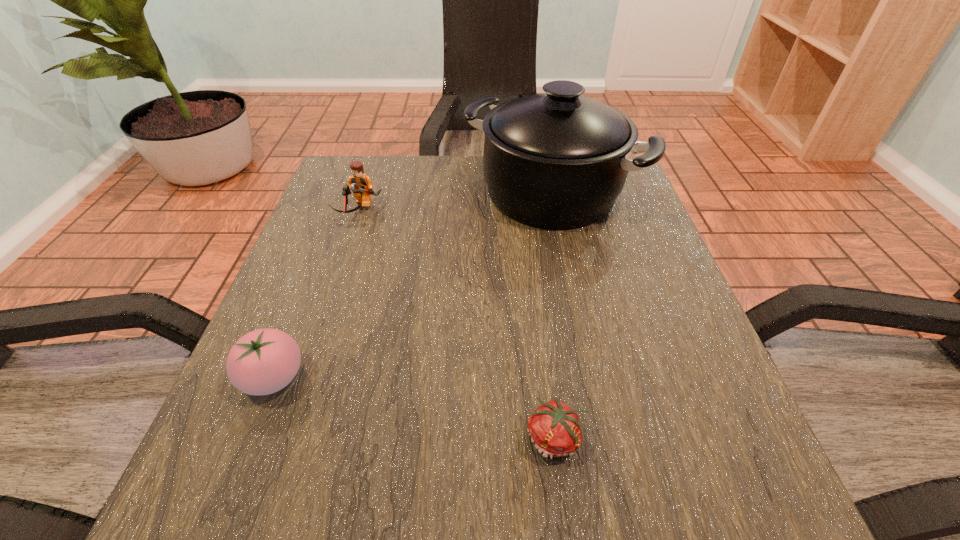
Locate an element on the screen. This screenshot has width=960, height=540. vacant space in between the Lego and the shorter tomato is located at coordinates (457, 325).

Where is `vacant area that lies between the third shortest object and the taller tomato`? The height and width of the screenshot is (540, 960). vacant area that lies between the third shortest object and the taller tomato is located at coordinates (316, 294).

This screenshot has height=540, width=960. In order to click on free space between the shorter tomato and the third tallest object in this screenshot , I will do `click(415, 408)`.

Find the location of a particular element. The height and width of the screenshot is (540, 960). unoccupied position between the shorter tomato and the third tallest object is located at coordinates (415, 408).

This screenshot has width=960, height=540. Find the location of `unoccupied area between the third farthest object and the shortest object`. unoccupied area between the third farthest object and the shortest object is located at coordinates (415, 408).

Identify the location of object that is the nearest to the second nearest object. click(x=555, y=428).

Identify which object is located as the third nearest to the second tallest object. Please provide its 2D coordinates. Your answer should be formatted as a tuple, i.e. [(x, y)], where the tuple contains the x and y coordinates of a point satisfying the conditions above.

[(555, 428)]

Locate an element on the screen. Image resolution: width=960 pixels, height=540 pixels. vacant space that satisfies the following two spatial constraints: 1. on the front side of the nearest object; 2. on the left side of the second shortest object is located at coordinates (250, 438).

At what (x,y) coordinates should I click in order to perform the action: click on free space that satisfies the following two spatial constraints: 1. holding a crossbow in the hands of the Lego; 2. on the left side of the right tomato. Please return your answer as a coordinate pair (x, y). This screenshot has width=960, height=540. Looking at the image, I should click on (281, 438).

Locate an element on the screen. The image size is (960, 540). vacant space that satisfies the following two spatial constraints: 1. on the back side of the second nearest object; 2. on the left side of the tallest object is located at coordinates (346, 193).